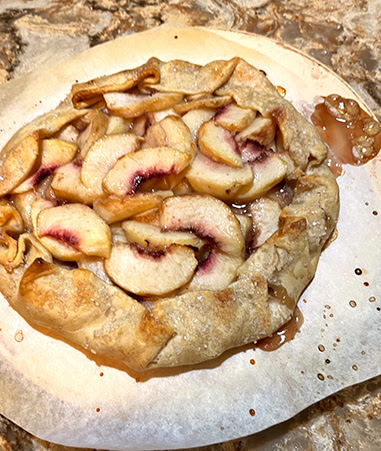
Where is `plate`? This screenshot has width=381, height=451. plate is located at coordinates (311, 68).